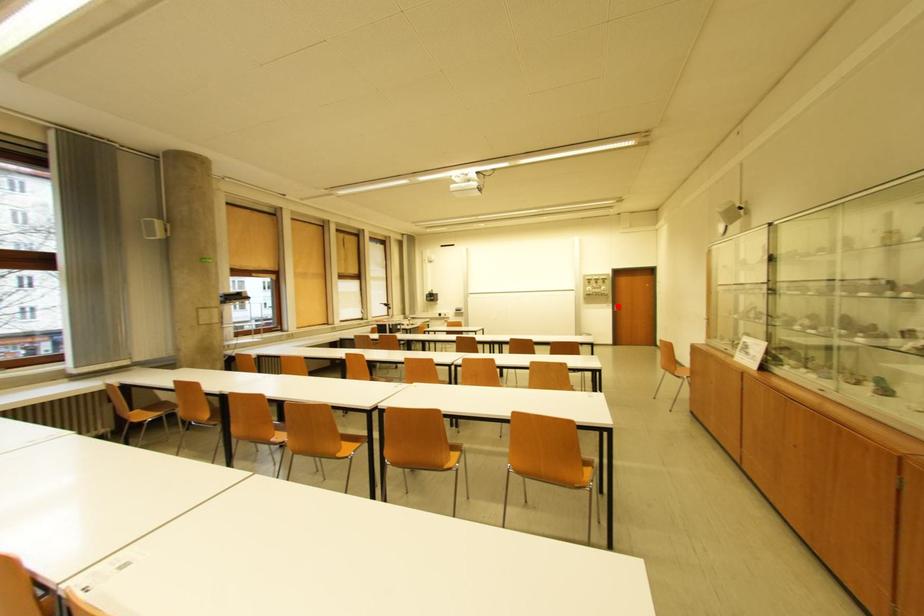
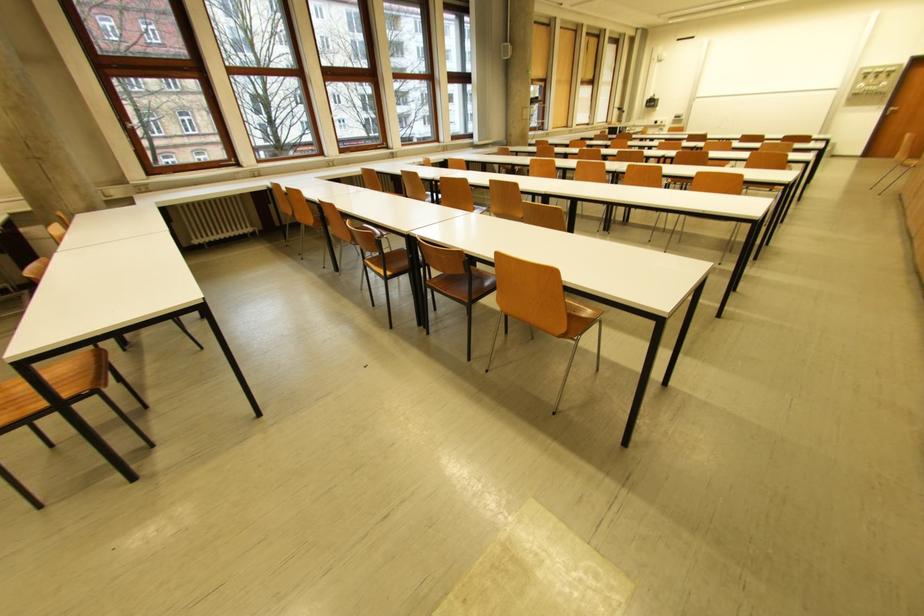
Question: I am providing you with two images of the same scene from different viewpoints. A red point is marked on the first image. Can you still see the location of the red point in image 2?

Choices:
 (A) Yes
 (B) No

Answer: (A)